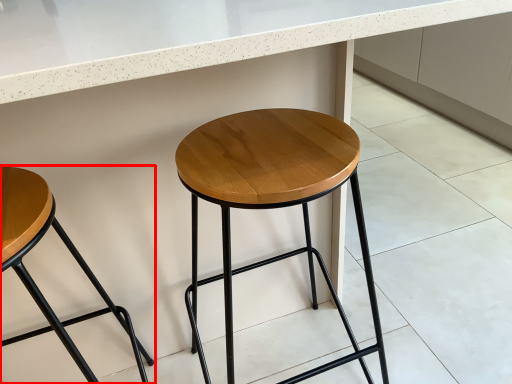
Question: Observing the image, what is the correct spatial positioning of stool (annotated by the red box) in reference to stool?

Choices:
 (A) left
 (B) right

Answer: (A)